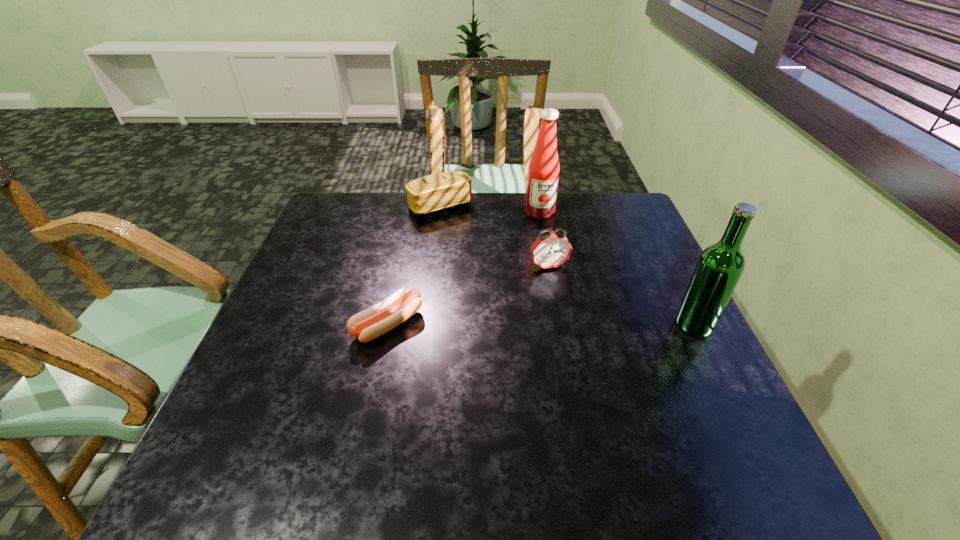
The height and width of the screenshot is (540, 960). Identify the location of sausage. (375, 321).

You are a GUI agent. You are given a task and a screenshot of the screen. Output one action in this format:
    pyautogui.click(x=<x>, y=<y>)
    Task: Click on the beer bottle
    This screenshot has width=960, height=540.
    Given the screenshot: What is the action you would take?
    pyautogui.click(x=720, y=266)

Image resolution: width=960 pixels, height=540 pixels. I want to click on alarm clock, so click(551, 249).

Image resolution: width=960 pixels, height=540 pixels. Identify the location of the third shortest object. [x=551, y=249].

Where is `clutch bag`? This screenshot has width=960, height=540. clutch bag is located at coordinates (439, 191).

Find the location of `condiment`. condiment is located at coordinates (543, 172).

In order to click on free region located on the back of the shortest object in this screenshot , I will do `click(403, 253)`.

You are a GUI agent. You are given a task and a screenshot of the screen. Output one action in this format:
    pyautogui.click(x=<x>, y=<y>)
    Task: Click on the vacant space situated on the left of the rightmost object
    The width and height of the screenshot is (960, 540).
    Given the screenshot: What is the action you would take?
    click(x=543, y=324)

The width and height of the screenshot is (960, 540). I want to click on free location located 0.270m on the clock face of the alarm clock, so click(587, 348).

Identify the location of free space located on the clock face of the alarm clock. This screenshot has height=540, width=960. (586, 345).